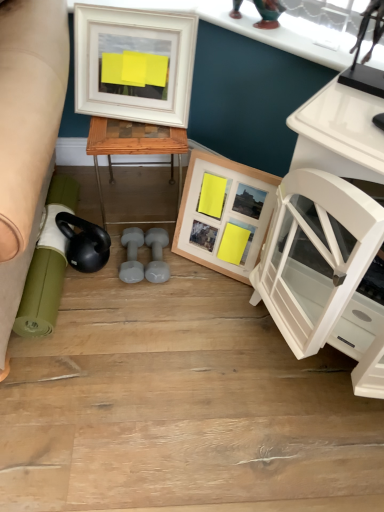
Where is `vacant space in front of gray rubber dumbbell at center, acting as the 2th dumbbell starting from the right`? The image size is (384, 512). vacant space in front of gray rubber dumbbell at center, acting as the 2th dumbbell starting from the right is located at coordinates (127, 307).